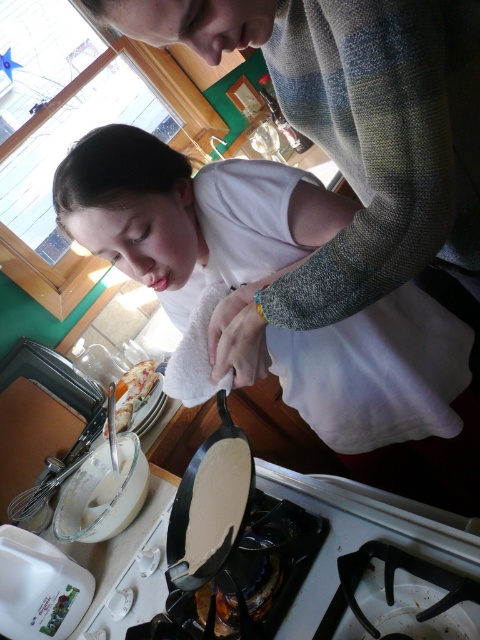
You are a chef who needs to move the black cast iron frying pan at center to the right side of the white glossy gas stove at lower center. Is this possible given their current positions?

The white glossy gas stove at lower center is already positioned on the right side of the black cast iron frying pan at center, so moving the frying pan further to the right would place it beyond the stove, which may not be feasible depending on the kitchen layout. However, based on the provided information, the frying pan is currently to the left of the stove. To move it to the right side of the stove, you would need to shift it horizontally towards the stove. Since there is no mention of obstacles, this 1